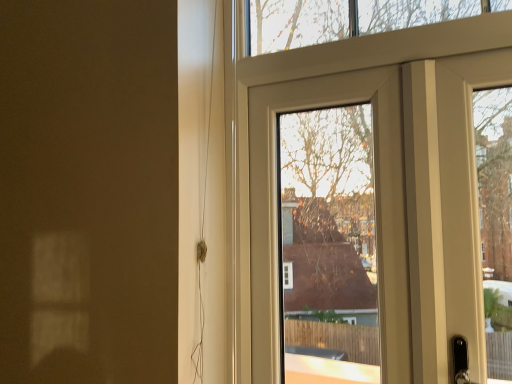
Question: Considering the positions of matte white door at center, acting as the first door starting from the left, and matte white door at upper right, which ranks as the first door in right-to-left order, in the image, is matte white door at center, acting as the first door starting from the left, wider or thinner than matte white door at upper right, which ranks as the first door in right-to-left order,?

Choices:
 (A) thin
 (B) wide

Answer: (A)

Question: Is matte white door at center, which is counted as the 2th door, starting from the right, taller or shorter than matte white door at upper right, the second door viewed from the left?

Choices:
 (A) short
 (B) tall

Answer: (A)

Question: Considering the positions of point (258, 329) and point (321, 67), is point (258, 329) closer or farther from the camera than point (321, 67)?

Choices:
 (A) farther
 (B) closer

Answer: (A)

Question: Is matte white door at upper right, the second door viewed from the left, in front of or behind matte white door at center, acting as the first door starting from the left, in the image?

Choices:
 (A) behind
 (B) front

Answer: (B)

Question: From a real-world perspective, is matte white door at upper right, the second door viewed from the left, physically located above or below matte white door at center, which is counted as the 2th door, starting from the right?

Choices:
 (A) above
 (B) below

Answer: (A)

Question: Is matte white door at upper right, which ranks as the first door in right-to-left order, inside the boundaries of matte white door at center, which is counted as the 2th door, starting from the right, or outside?

Choices:
 (A) inside
 (B) outside

Answer: (B)

Question: Considering the positions of matte white door at upper right, which ranks as the first door in right-to-left order, and matte white door at center, which is counted as the 2th door, starting from the right, in the image, is matte white door at upper right, which ranks as the first door in right-to-left order, taller or shorter than matte white door at center, which is counted as the 2th door, starting from the right,?

Choices:
 (A) short
 (B) tall

Answer: (B)